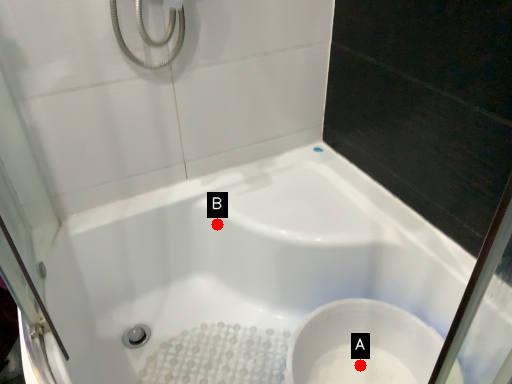
Question: Two points are circled on the image, labeled by A and B beside each circle. Which point is farther from the camera taking this photo?

Choices:
 (A) A is further
 (B) B is further

Answer: (B)